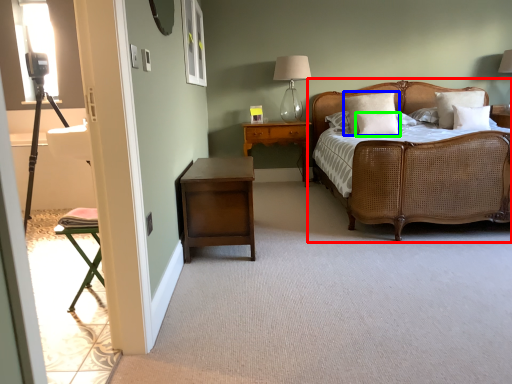
Question: Based on their relative distances, which object is farther from bed (highlighted by a red box)? Choose from pillow (highlighted by a blue box) and pillow (highlighted by a green box).

Choices:
 (A) pillow
 (B) pillow

Answer: (A)